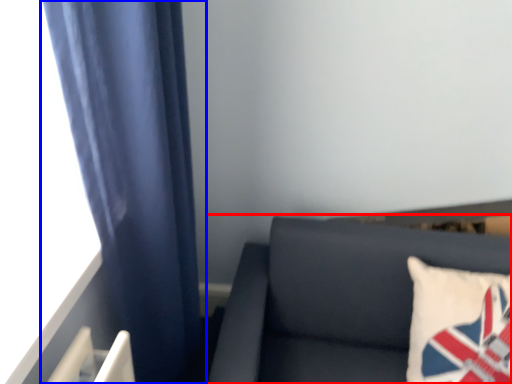
Question: Among these objects, which one is farthest to the camera, furniture (highlighted by a red box) or curtain (highlighted by a blue box)?

Choices:
 (A) furniture
 (B) curtain

Answer: (A)